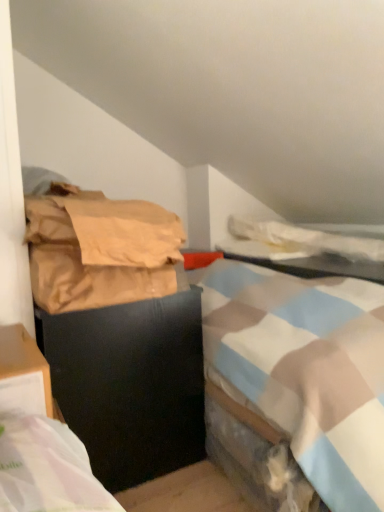
Identify the location of brown paper bag at left. The width and height of the screenshot is (384, 512). (99, 249).

What is the approximate height of matte plastic table at center?

It is 2.95 inches.

This screenshot has height=512, width=384. I want to click on brown paper bag at left, so click(99, 249).

Considering the sizes of objects brown paper bag at left and white soft blanket at upper right in the image provided, who is taller, brown paper bag at left or white soft blanket at upper right?

brown paper bag at left is taller.

Which object is thinner, brown paper bag at left or white soft blanket at upper right?

brown paper bag at left.

Is brown paper bag at left completely or partially outside of white soft blanket at upper right?

brown paper bag at left lies outside white soft blanket at upper right's area.

Is the position of brown paper bag at left more distant than that of white soft blanket at upper right?

No, brown paper bag at left is in front of white soft blanket at upper right.

From a real-world perspective, is black matte trash can at left physically above matte plastic table at center?

No, from a real-world perspective, black matte trash can at left is not over matte plastic table at center

Is black matte trash can at left wider than matte plastic table at center?

Incorrect, the width of black matte trash can at left does not surpass that of matte plastic table at center.

From the image's perspective, is black matte trash can at left positioned above or below matte plastic table at center?

Clearly, from the image's perspective, black matte trash can at left is below matte plastic table at center.

Could you tell me if matte plastic table at center is facing white soft blanket at upper right?

No.

Is matte plastic table at center surrounding white soft blanket at upper right?

Actually, white soft blanket at upper right is outside matte plastic table at center.

From the image's perspective, is matte plastic table at center located above or below white soft blanket at upper right?

From the image's perspective, matte plastic table at center appears below white soft blanket at upper right.

What's the angular difference between black matte trash can at left and white soft blanket at upper right's facing directions?

4.6 degrees.

Considering the relative sizes of black matte trash can at left and white soft blanket at upper right in the image provided, is black matte trash can at left wider than white soft blanket at upper right?

No, black matte trash can at left is not wider than white soft blanket at upper right.

Is white soft blanket at upper right at the back of black matte trash can at left?

black matte trash can at left does not have its back to white soft blanket at upper right.

Is black matte trash can at left at the left side of white soft blanket at upper right?

Yes, black matte trash can at left is to the left of white soft blanket at upper right.

Is white soft blanket at upper right oriented away from matte plastic table at center?

No, white soft blanket at upper right's orientation is not away from matte plastic table at center.

Between white soft blanket at upper right and matte plastic table at center, which one is positioned in front?

matte plastic table at center is in front.

Does point (276, 234) appear closer or farther from the camera than point (241, 250)?

Point (276, 234).

Is white soft blanket at upper right to the right of matte plastic table at center from the viewer's perspective?

In fact, white soft blanket at upper right is to the left of matte plastic table at center.

Consider the image. Can we say white soft blanket at upper right lies outside brown paper bag at left?

white soft blanket at upper right lies outside brown paper bag at left's area.

The height and width of the screenshot is (512, 384). I want to click on material on the left side of white soft blanket at upper right, so click(99, 249).

Measure the distance from white soft blanket at upper right to brown paper bag at left.

white soft blanket at upper right and brown paper bag at left are 3.58 feet apart from each other.

From the image's perspective, is brown paper bag at left on black matte trash can at left?

Yes, from the image's perspective, brown paper bag at left is over black matte trash can at left.

Does brown paper bag at left have a lesser height compared to black matte trash can at left?

Yes, brown paper bag at left is shorter than black matte trash can at left.

Can you see brown paper bag at left touching black matte trash can at left?

There is a gap between brown paper bag at left and black matte trash can at left.

Considering the sizes of brown paper bag at left and black matte trash can at left in the image, is brown paper bag at left wider or thinner than black matte trash can at left?

brown paper bag at left is thinner than black matte trash can at left.

Locate an element on the screen. Image resolution: width=384 pixels, height=512 pixels. material that appears on the left of white soft blanket at upper right is located at coordinates (99, 249).

Where is `furniture in front of the matte plastic table at center`? furniture in front of the matte plastic table at center is located at coordinates (130, 384).

Considering their positions, is white soft blanket at upper right positioned further to brown paper bag at left than matte plastic table at center?

white soft blanket at upper right.

Considering their positions, is brown paper bag at left positioned closer to matte plastic table at center than white soft blanket at upper right?

white soft blanket at upper right.

Looking at the image, which one is located closer to matte plastic table at center, brown paper bag at left or black matte trash can at left?

Based on the image, black matte trash can at left appears to be nearer to matte plastic table at center.

When comparing their distances from matte plastic table at center, does black matte trash can at left or brown paper bag at left seem further?

Among the two, brown paper bag at left is located further to matte plastic table at center.

Based on their spatial positions, is white soft blanket at upper right or black matte trash can at left further from brown paper bag at left?

Based on the image, white soft blanket at upper right appears to be further to brown paper bag at left.

From the picture: When comparing their distances from brown paper bag at left, does matte plastic table at center or white soft blanket at upper right seem further?

The object further to brown paper bag at left is white soft blanket at upper right.

Based on the photo, looking at the image, which one is located further to black matte trash can at left, matte plastic table at center or white soft blanket at upper right?

white soft blanket at upper right is positioned further to the anchor black matte trash can at left.

Which object lies further to the anchor point matte plastic table at center, white soft blanket at upper right or black matte trash can at left?

black matte trash can at left is further to matte plastic table at center.

Where is `material located between black matte trash can at left and matte plastic table at center in the left-right direction`? Image resolution: width=384 pixels, height=512 pixels. material located between black matte trash can at left and matte plastic table at center in the left-right direction is located at coordinates (99, 249).

Locate an element on the screen. This screenshot has width=384, height=512. blanket between brown paper bag at left and matte plastic table at center in the horizontal direction is located at coordinates (305, 239).

At what (x,y) coordinates should I click in order to perform the action: click on material located between black matte trash can at left and white soft blanket at upper right in the left-right direction. Please return your answer as a coordinate pair (x, y). The height and width of the screenshot is (512, 384). Looking at the image, I should click on (99, 249).

The height and width of the screenshot is (512, 384). I want to click on blanket situated between black matte trash can at left and matte plastic table at center from left to right, so click(305, 239).